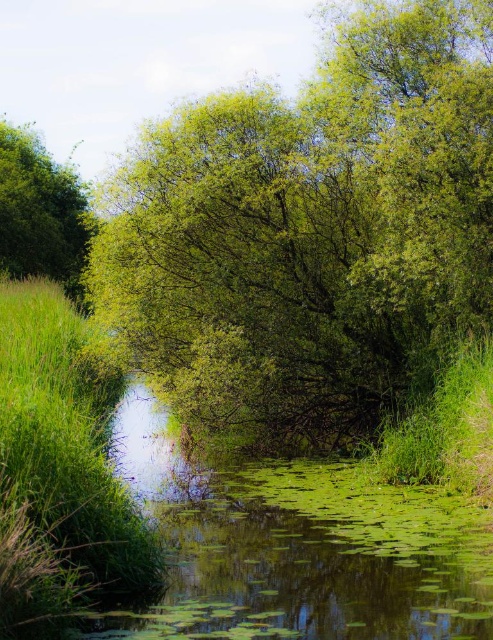
You are standing at the point marked as point (60, 474) in the image. What type of surface are you currently standing on?

The point (60, 474) is on green grass at left, so you are standing on green grass.

You are standing at the edge of the waterway and notice two green leafy trees in the scene. Which tree, the green leafy tree at center or the green leafy tree at upper left, is positioned higher up in the image?

The green leafy tree at upper left is positioned higher up in the image than the green leafy tree at center.

You are standing at the edge of the waterway and want to determine which object occupies more horizontal space. Which one is wider between the green leafy tree at center and the green grass at left?

The green leafy tree at center is wider than the green grass at left, so it occupies more horizontal space.